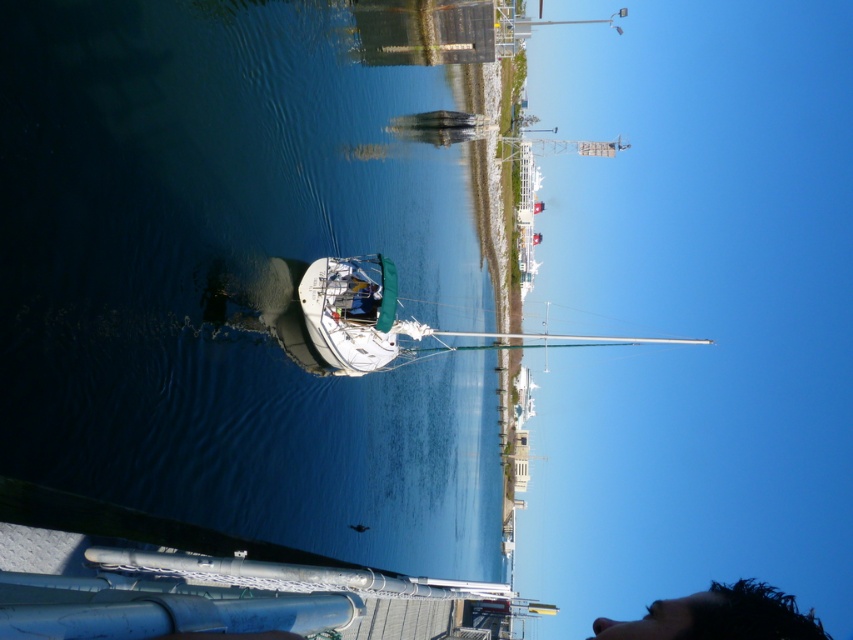
Question: Observing the image, what is the correct spatial positioning of white glossy water at center in reference to white glossy sailboat at center?

Choices:
 (A) right
 (B) left

Answer: (A)

Question: Which is nearer to the white glossy sailboat at center?

Choices:
 (A) black hair at lower right
 (B) white glossy water at center

Answer: (B)

Question: Is white glossy water at center above white glossy sailboat at center?

Choices:
 (A) no
 (B) yes

Answer: (B)

Question: Among these objects, which one is nearest to the camera?

Choices:
 (A) white glossy sailboat at center
 (B) white glossy water at center
 (C) black hair at lower right

Answer: (C)

Question: Can you confirm if white glossy water at center is positioned above white glossy sailboat at center?

Choices:
 (A) yes
 (B) no

Answer: (A)

Question: Based on their relative distances, which object is nearer to the white glossy sailboat at center?

Choices:
 (A) white glossy water at center
 (B) black hair at lower right

Answer: (A)